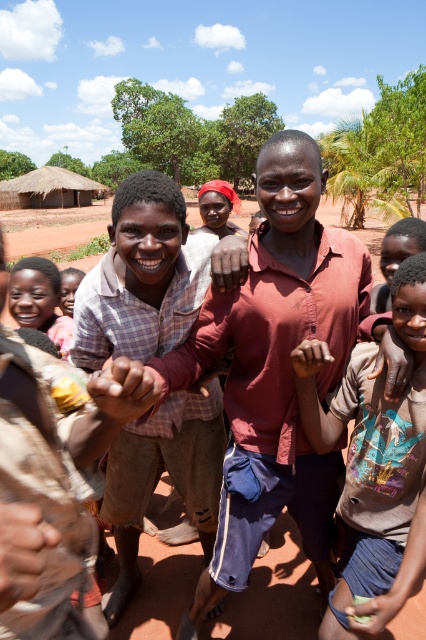
Is matte red shirt at center wider than light brown cotton shirt at center?

Yes, matte red shirt at center is wider than light brown cotton shirt at center.

Is matte red shirt at center to the right of light brown cotton shirt at center from the viewer's perspective?

In fact, matte red shirt at center is to the left of light brown cotton shirt at center.

I want to click on matte red shirt at center, so click(278, 358).

Between matte red shirt at center and plaid fabric shirt at center, which one is positioned lower?

plaid fabric shirt at center is lower down.

Find the location of a particular element. This screenshot has width=426, height=640. matte red shirt at center is located at coordinates (278, 358).

Is plaid fabric shirt at center behind light brown cotton shirt at center?

Yes.

You are a GUI agent. You are given a task and a screenshot of the screen. Output one action in this format:
    pyautogui.click(x=<x>, y=<y>)
    Task: Click on the plaid fabric shirt at center
    Image resolution: width=426 pixels, height=640 pixels.
    Given the screenshot: What is the action you would take?
    click(x=141, y=276)

Locate an element on the screen. This screenshot has height=640, width=426. plaid fabric shirt at center is located at coordinates (141, 276).